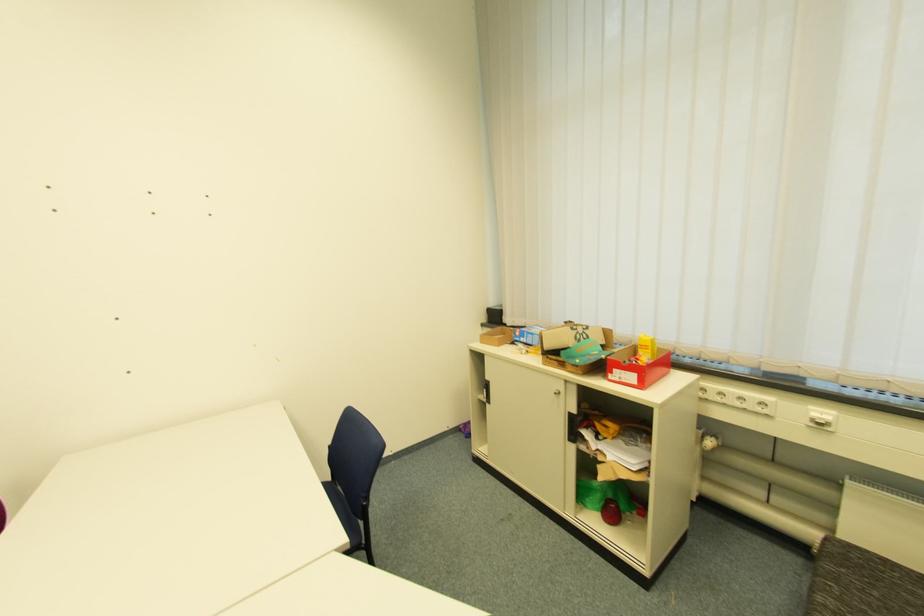
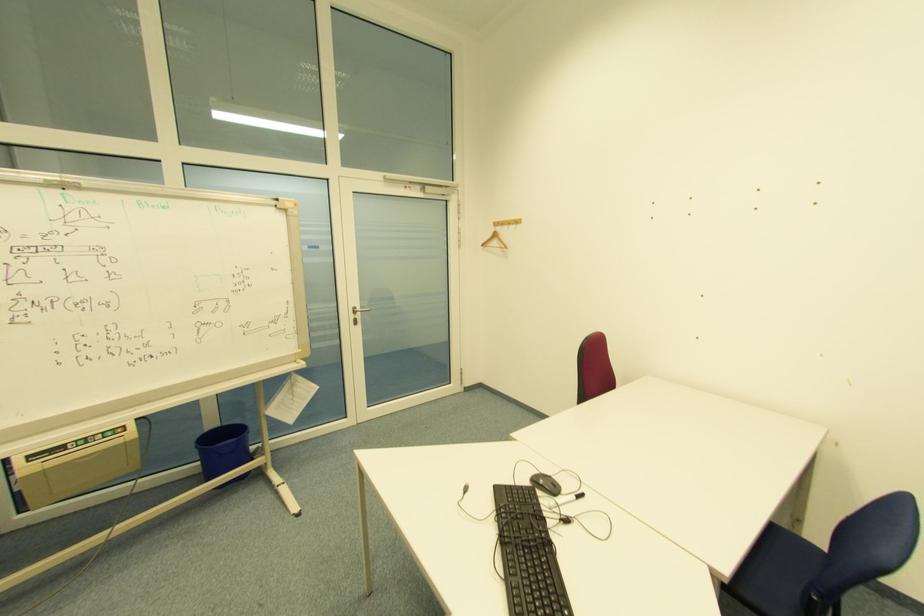
Question: How did the camera likely rotate?

Choices:
 (A) Left
 (B) Right
 (C) Up
 (D) Down

Answer: (A)